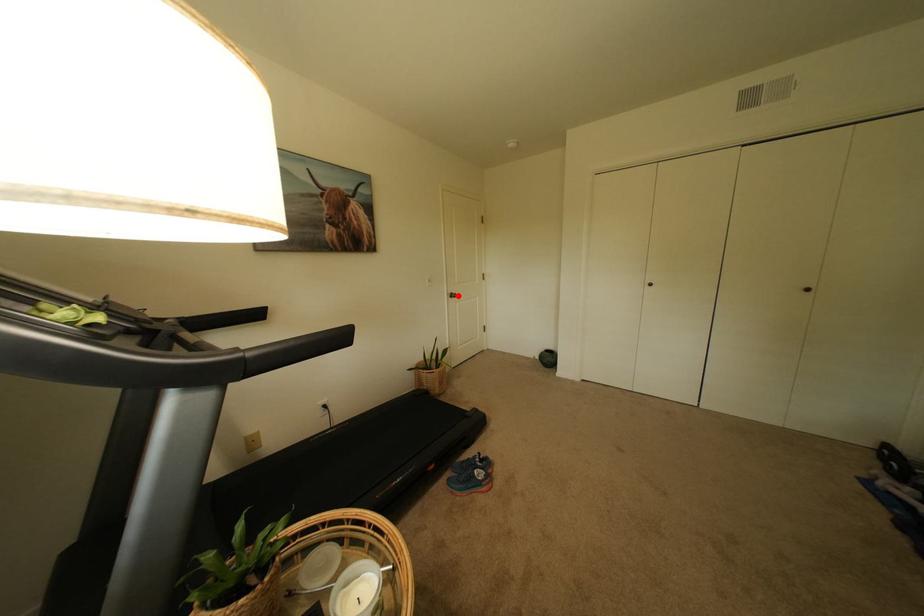
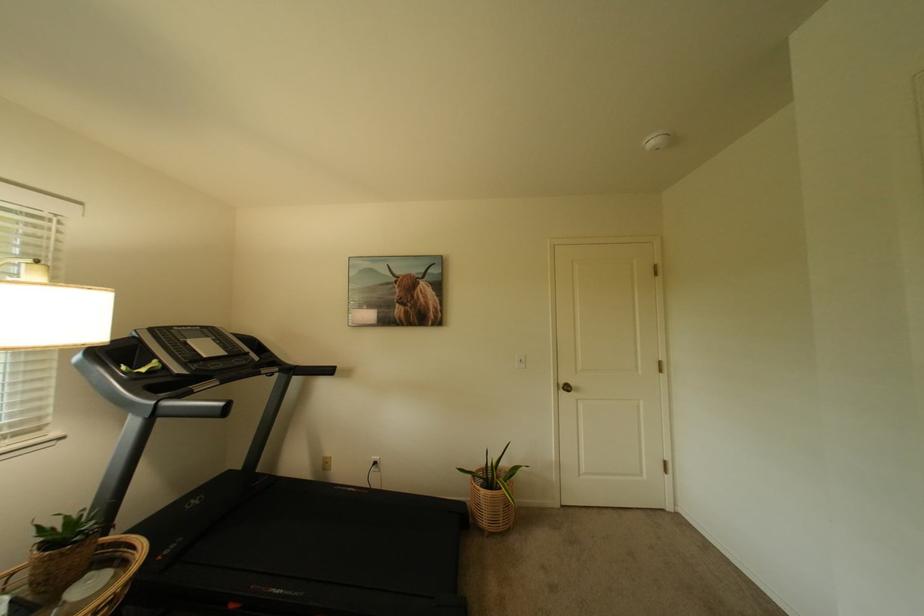
The point at the highlighted location is marked in the first image. Where is the corresponding point in the second image?

(569, 386)